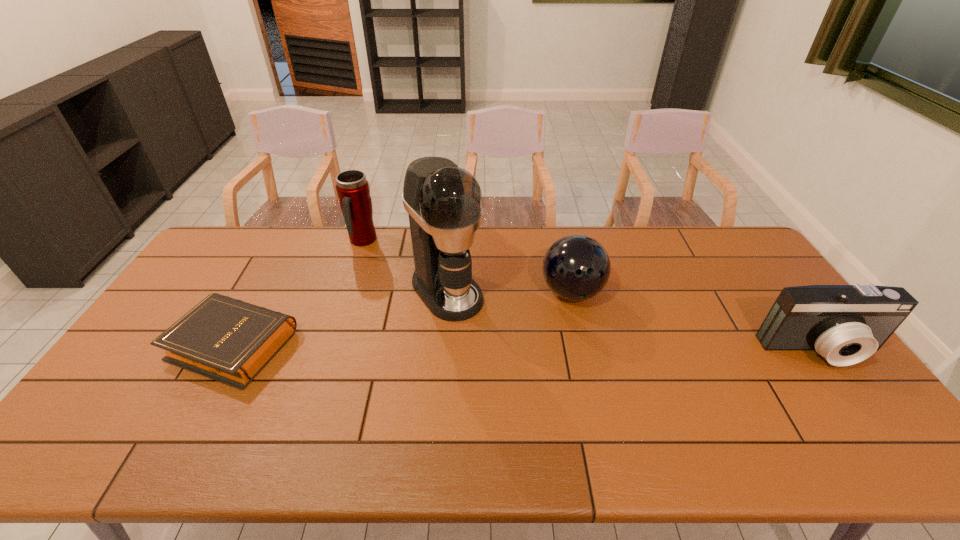
Locate an element on the screen. thermos bottle at the far edge is located at coordinates (352, 188).

Locate an element on the screen. The image size is (960, 540). object at the left edge is located at coordinates (228, 340).

Where is `object located in the right edge section of the desktop`? This screenshot has height=540, width=960. object located in the right edge section of the desktop is located at coordinates (845, 324).

Identify the location of vacant space at the far edge. (324, 240).

The width and height of the screenshot is (960, 540). Find the location of `free spot at the near edge of the desktop`. free spot at the near edge of the desktop is located at coordinates (202, 413).

Identify the location of vacant space at the right edge of the desktop. (802, 370).

The width and height of the screenshot is (960, 540). Find the location of `blank area at the near left corner`. blank area at the near left corner is located at coordinates [92, 420].

In the image, there is a desktop. Where is `vacant space at the near right corner`? The image size is (960, 540). vacant space at the near right corner is located at coordinates (815, 394).

Locate an element on the screen. The width and height of the screenshot is (960, 540). vacant space that's between the third object from left to right and the camcorder is located at coordinates (635, 321).

Find the location of a particular element. This screenshot has width=960, height=540. blank region between the shortest object and the third object from left to right is located at coordinates (341, 318).